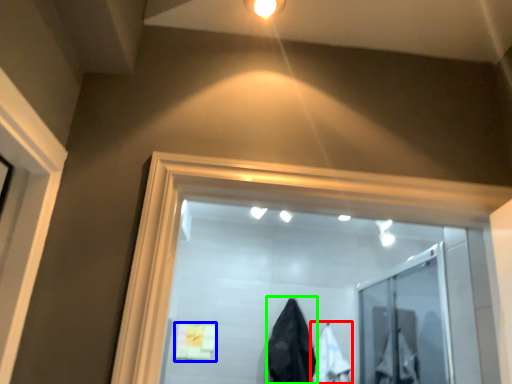
Question: Which is farther away from garment (highlighted by a red box)? bath towel (highlighted by a blue box) or garment (highlighted by a green box)?

Choices:
 (A) bath towel
 (B) garment

Answer: (A)